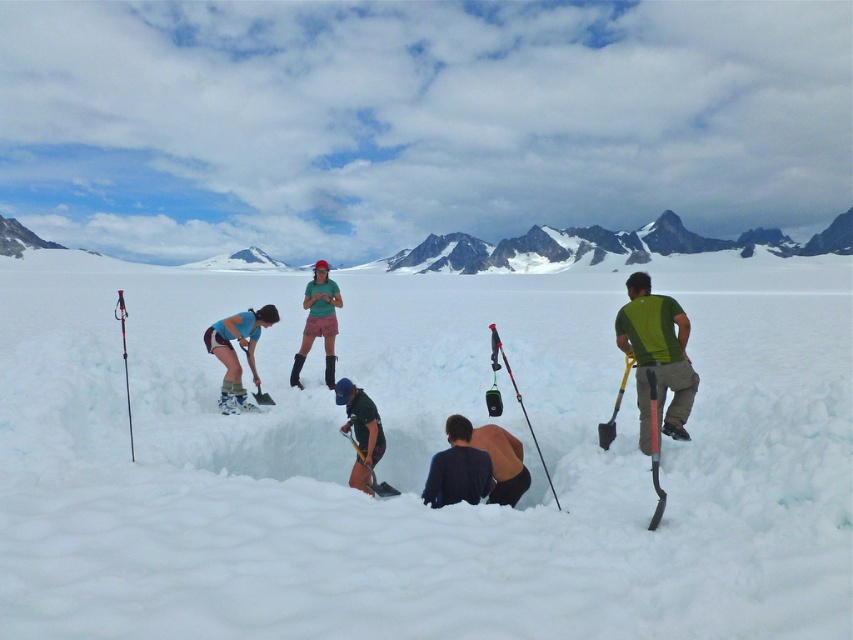
You are a member of the group in the snowy landscape. You need to hand the green fabric shovel at right to the person wearing the dark green fabric jacket at center. Can you reach them without moving from your current position?

The green fabric shovel at right is to the right of the dark green fabric jacket at center, so you can reach the shovel and hand it to the person wearing the dark green fabric jacket at center by moving the shovel towards the left.

You are part of a rescue team on a glacier. You need to determine which area is safer to set up your equipment. The white fluffy snow at center and the dark blue fabric at center are both visible. Based on their sizes, which one should you avoid placing heavy gear on?

The white fluffy snow at center is larger in size than the dark blue fabric at center, so you should avoid placing heavy gear on the white fluffy snow at center as it might be less stable due to its larger and fluffier structure.